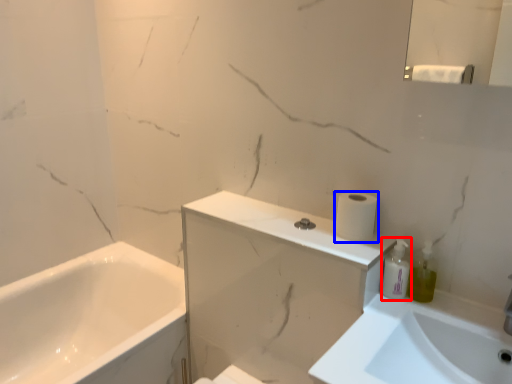
Question: Which object is closer to the camera taking this photo, toiletry (highlighted by a red box) or toilet paper (highlighted by a blue box)?

Choices:
 (A) toiletry
 (B) toilet paper

Answer: (A)